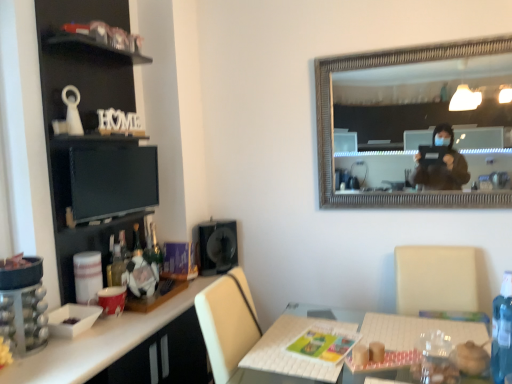
Question: Is clear plastic bottle at lower right taller or shorter than white glossy desk at lower left?

Choices:
 (A) tall
 (B) short

Answer: (B)

Question: Would you say clear plastic bottle at lower right is inside or outside white glossy desk at lower left?

Choices:
 (A) inside
 (B) outside

Answer: (B)

Question: Which of these objects is positioned farthest from the black glossy computer monitor at upper left?

Choices:
 (A) black matte speaker at center
 (B) white glossy desk at lower left
 (C) clear plastic bottle at lower right
 (D) black matte cabinet at left

Answer: (C)

Question: Estimate the real-world distances between objects in this image. Which object is closer to the black matte cabinet at left?

Choices:
 (A) black glossy computer monitor at upper left
 (B) black matte speaker at center
 (C) white glossy desk at lower left
 (D) clear plastic bottle at lower right

Answer: (A)